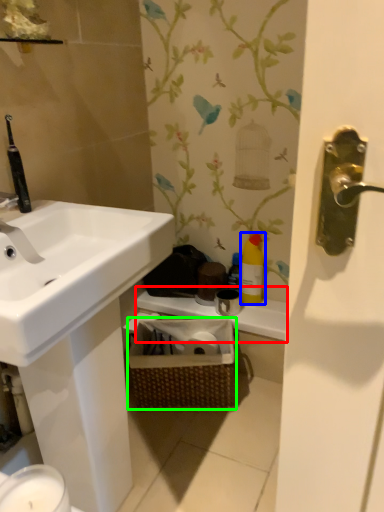
Question: Considering the real-world distances, which object is farthest from counter top (highlighted by a red box)? cleaning product (highlighted by a blue box) or basket (highlighted by a green box)?

Choices:
 (A) cleaning product
 (B) basket

Answer: (B)